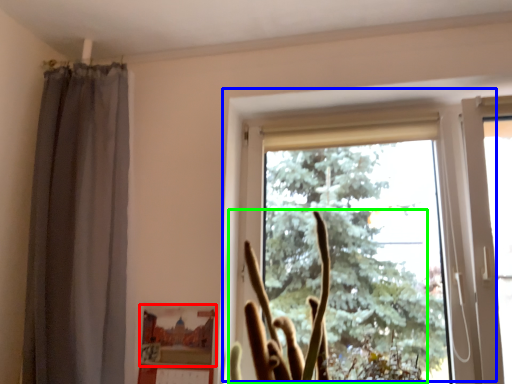
Question: Estimate the real-world distances between objects in this image. Which object is farther from picture frame (highlighted by a red box), window (highlighted by a blue box) or plant (highlighted by a green box)?

Choices:
 (A) window
 (B) plant

Answer: (A)